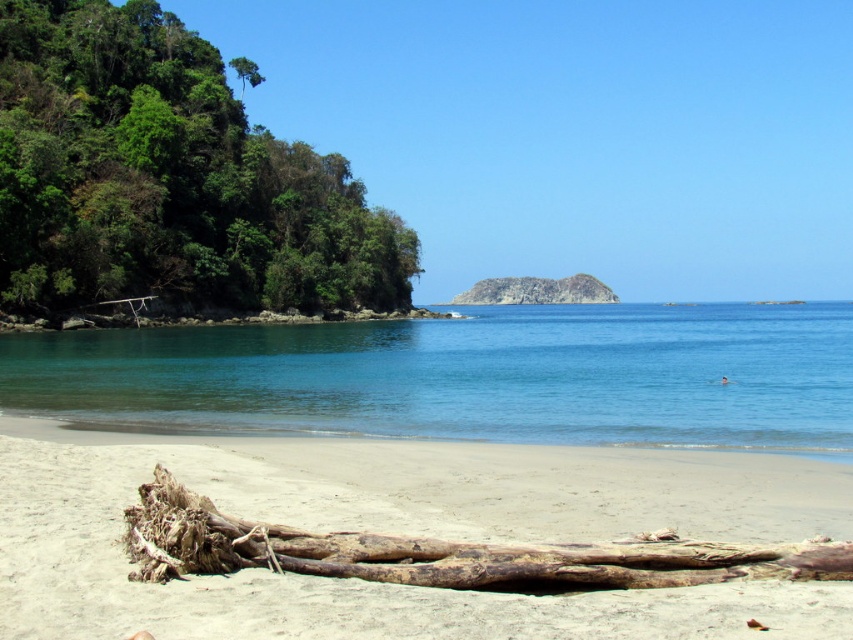
You are a photographer planning to capture the beach scene. You want to ensure both the clear blue water at center and the rusty rock at center are visible in your shot. Which object will occupy more space in your photo?

The clear blue water at center is bigger than the rusty rock at center, so it will occupy more space in the photo.

You are planning to build a sandcastle on the beach. You have two options for materials available in the scene. Which material would you choose between the light beige sand at lower center and the rusty rock at center, and why?

You should choose the light beige sand at lower center because it has a smaller size compared to the rusty rock at center, making it easier to mold and stack for building a sandcastle.

You are a drone operator trying to capture a photo of the beach scene. The camera is currently positioned at point A, which is at coordinates 0.7, 0.5. You want to adjust the camera to focus on the light beige sand at lower center. Should you move the camera slightly to the left or right to center the sand in the frame?

The light beige sand at lower center is located at point (402, 532). Since the camera is at (426, 448), you should move it slightly to the right to center the sand in the frame.